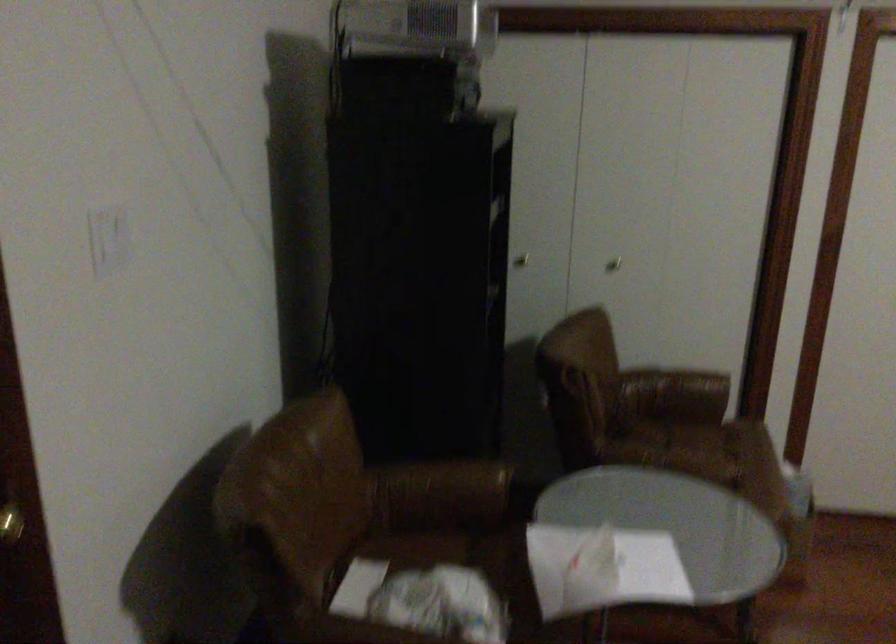
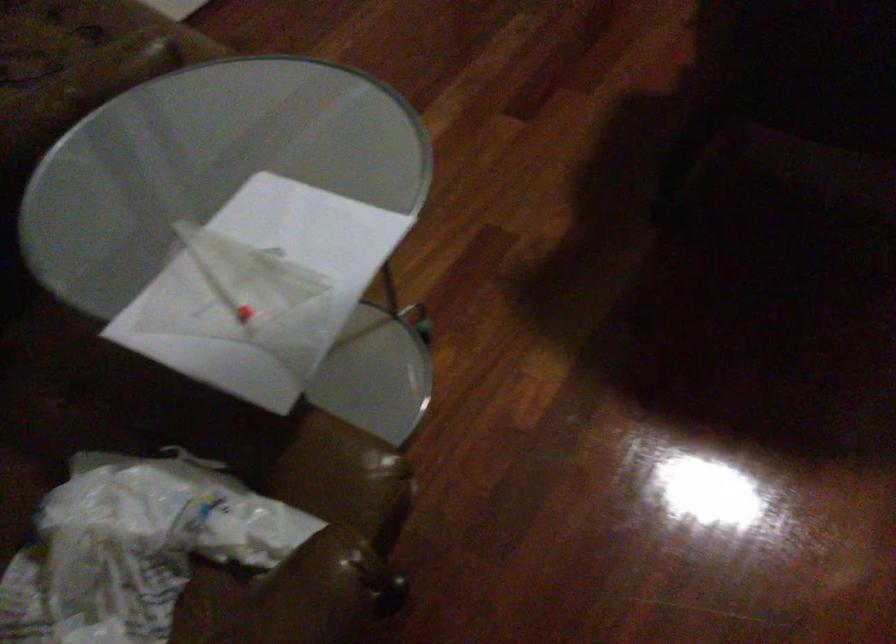
Based on the continuous images, in which direction is the camera rotating?

The camera's rotation is toward right-down.